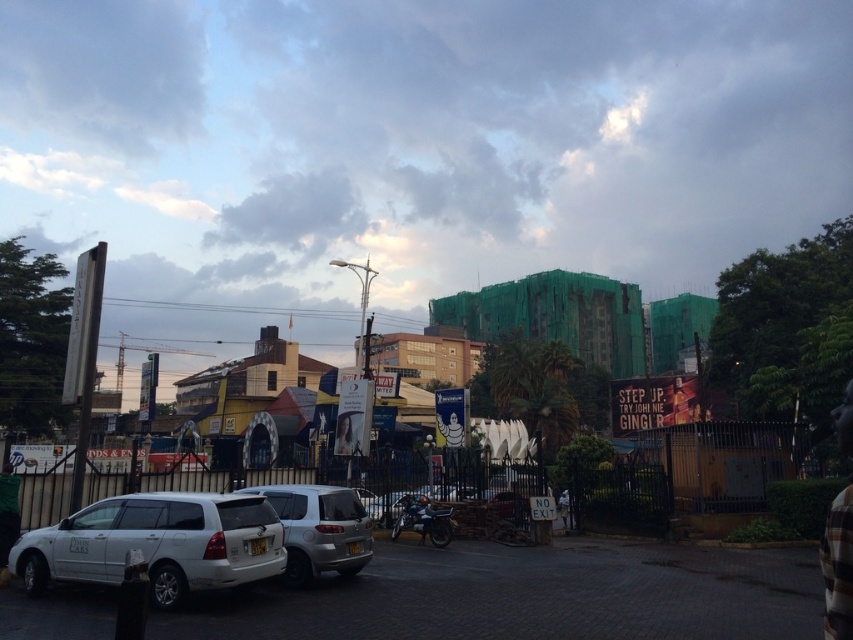
Question: Is white matte van at lower left positioned at the back of satin silver suv at center?

Choices:
 (A) yes
 (B) no

Answer: (B)

Question: Is white matte van at lower left thinner than satin silver suv at center?

Choices:
 (A) no
 (B) yes

Answer: (A)

Question: Does white matte van at lower left have a greater width compared to satin silver suv at center?

Choices:
 (A) yes
 (B) no

Answer: (A)

Question: Which object is closer to the camera taking this photo?

Choices:
 (A) white matte van at lower left
 (B) satin silver suv at center

Answer: (A)